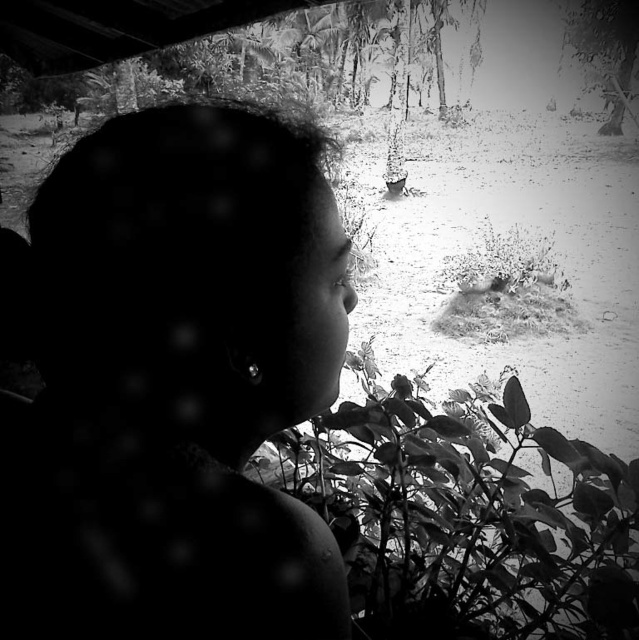
Based on the scene described, which object is shorter in height between the dark hair at left and the leathery green leaves at center?

The dark hair at left is shorter in height compared to the leathery green leaves at center according to the description.